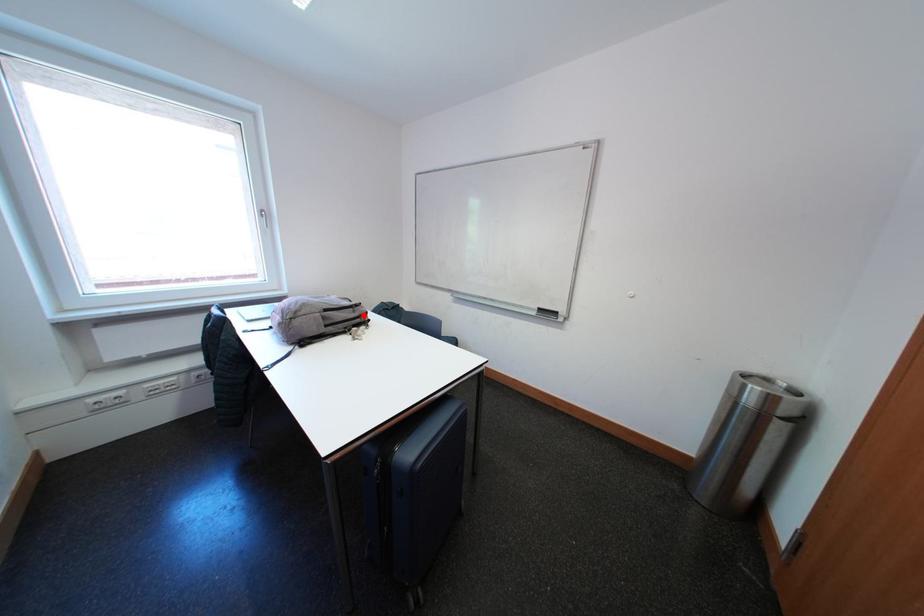
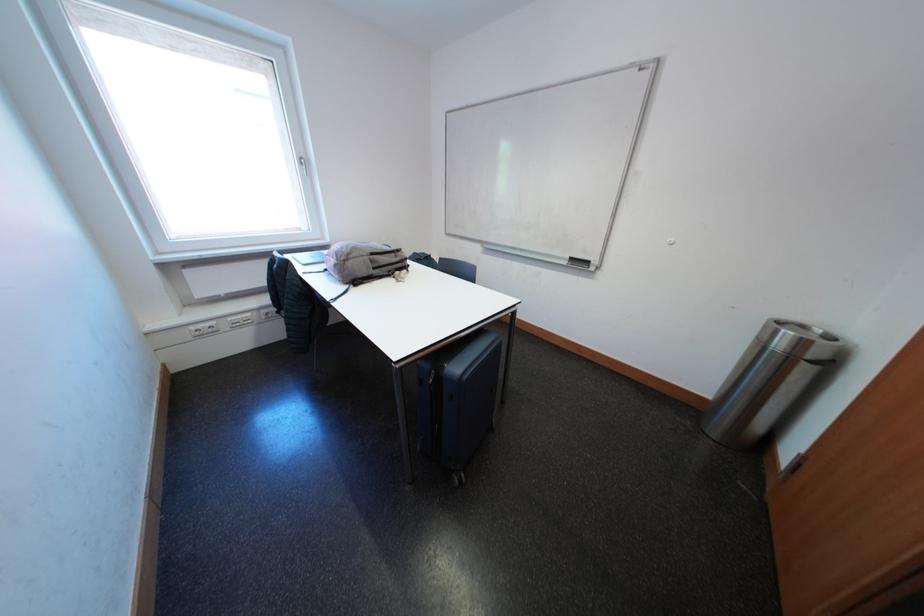
Question: I am providing you with two images of the same scene from different viewpoints. Image1 has a red point marked. In image2, the corresponding 3D location appears at what relative position? Reply with the corresponding letter.

Choices:
 (A) Closer
 (B) Farther

Answer: (B)